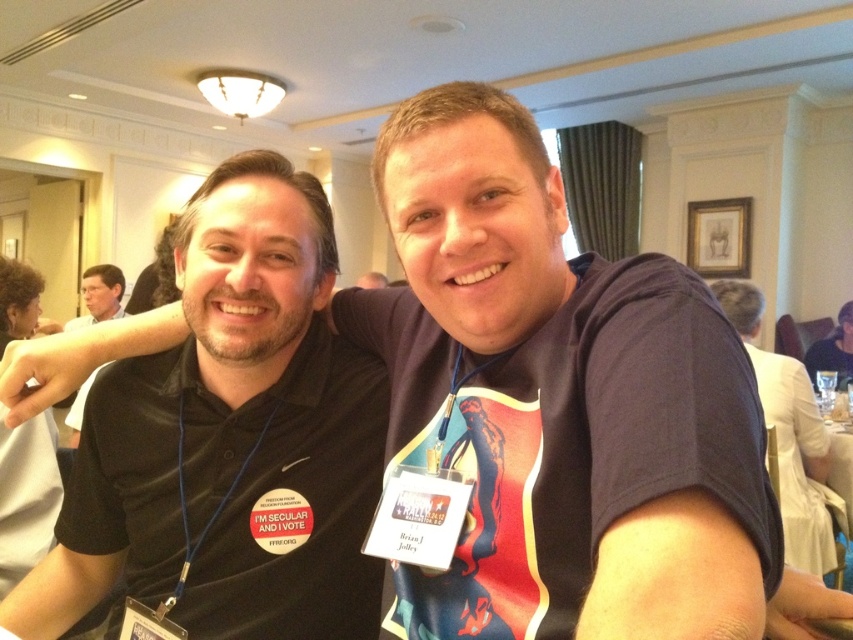
Is dark blue t-shirt at center to the left of black shirt at left from the viewer's perspective?

Incorrect, dark blue t-shirt at center is not on the left side of black shirt at left.

Measure the distance between point (828, 550) and camera.

2.68 meters

Image resolution: width=853 pixels, height=640 pixels. I want to click on dark blue t-shirt at center, so click(x=790, y=438).

You are a GUI agent. You are given a task and a screenshot of the screen. Output one action in this format:
    pyautogui.click(x=<x>, y=<y>)
    Task: Click on the black matte shirt at left
    
    Given the screenshot: What is the action you would take?
    pyautogui.click(x=230, y=440)

Is black matte shirt at left thinner than black fabric shirt at upper right?

Yes.

Who is more forward, (167, 429) or (840, 307)?

Point (167, 429)

What are the coordinates of `black matte shirt at left` in the screenshot? It's located at click(x=230, y=440).

Does black matte shirt at left come behind black shirt at left?

No, it is not.

Who is higher up, black matte shirt at left or black shirt at left?

Positioned higher is black shirt at left.

Find the location of `black matte shirt at left`. black matte shirt at left is located at coordinates (230, 440).

Find the location of a particular element. black matte shirt at left is located at coordinates (230, 440).